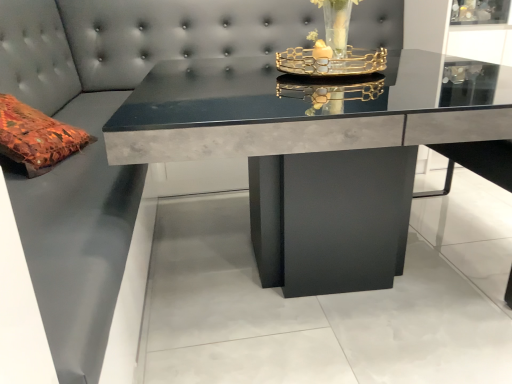
Question: Visually, is matte concrete table at center positioned to the left or to the right of gold metallic tray at center?

Choices:
 (A) right
 (B) left

Answer: (B)

Question: From a real-world perspective, is matte concrete table at center above or below gold metallic tray at center?

Choices:
 (A) above
 (B) below

Answer: (B)

Question: Considering their positions, is matte concrete table at center located in front of or behind gold metallic tray at center?

Choices:
 (A) front
 (B) behind

Answer: (A)

Question: Is gold metallic tray at center bigger or smaller than matte concrete table at center?

Choices:
 (A) big
 (B) small

Answer: (B)

Question: From the image's perspective, is gold metallic tray at center located above or below matte concrete table at center?

Choices:
 (A) below
 (B) above

Answer: (B)

Question: Is gold metallic tray at center situated inside matte concrete table at center or outside?

Choices:
 (A) inside
 (B) outside

Answer: (B)

Question: Is gold metallic tray at center in front of or behind matte concrete table at center in the image?

Choices:
 (A) front
 (B) behind

Answer: (B)